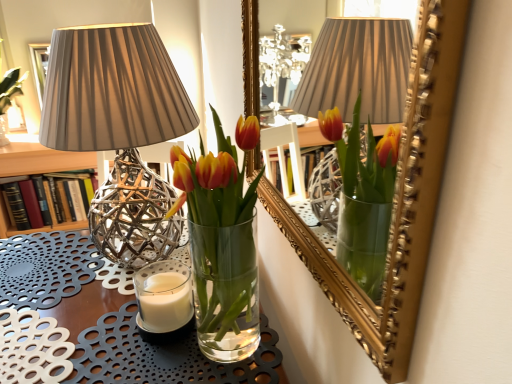
Question: Is clear glass vase at center turned away from hardcover book at left?

Choices:
 (A) no
 (B) yes

Answer: (A)

Question: Does clear glass vase at center have a smaller size compared to hardcover book at left?

Choices:
 (A) no
 (B) yes

Answer: (A)

Question: From a real-world perspective, is clear glass vase at center located higher than hardcover book at left?

Choices:
 (A) no
 (B) yes

Answer: (A)

Question: Is clear glass vase at center directly adjacent to hardcover book at left?

Choices:
 (A) no
 (B) yes

Answer: (A)

Question: Does clear glass vase at center turn towards hardcover book at left?

Choices:
 (A) no
 (B) yes

Answer: (A)

Question: Is translucent glass vase at center bigger or smaller than clear glass vase at center?

Choices:
 (A) small
 (B) big

Answer: (A)

Question: Looking at their shapes, would you say translucent glass vase at center is wider or thinner than clear glass vase at center?

Choices:
 (A) wide
 (B) thin

Answer: (B)

Question: Considering their positions, is translucent glass vase at center located in front of or behind clear glass vase at center?

Choices:
 (A) front
 (B) behind

Answer: (B)

Question: Do you think translucent glass vase at center is within clear glass vase at center, or outside of it?

Choices:
 (A) inside
 (B) outside

Answer: (B)

Question: In terms of size, does matte silver lamp at left appear bigger or smaller than clear glass vase at center?

Choices:
 (A) big
 (B) small

Answer: (B)

Question: Considering the positions of matte silver lamp at left and clear glass vase at center in the image, is matte silver lamp at left wider or thinner than clear glass vase at center?

Choices:
 (A) thin
 (B) wide

Answer: (A)

Question: From a real-world perspective, is matte silver lamp at left physically located above or below clear glass vase at center?

Choices:
 (A) above
 (B) below

Answer: (A)

Question: Does point (155, 180) appear closer or farther from the camera than point (82, 326)?

Choices:
 (A) closer
 (B) farther

Answer: (B)

Question: Is translucent glass vase at center spatially inside hardcover book at left, or outside of it?

Choices:
 (A) outside
 (B) inside

Answer: (A)

Question: From a real-world perspective, is translucent glass vase at center positioned above or below hardcover book at left?

Choices:
 (A) below
 (B) above

Answer: (B)